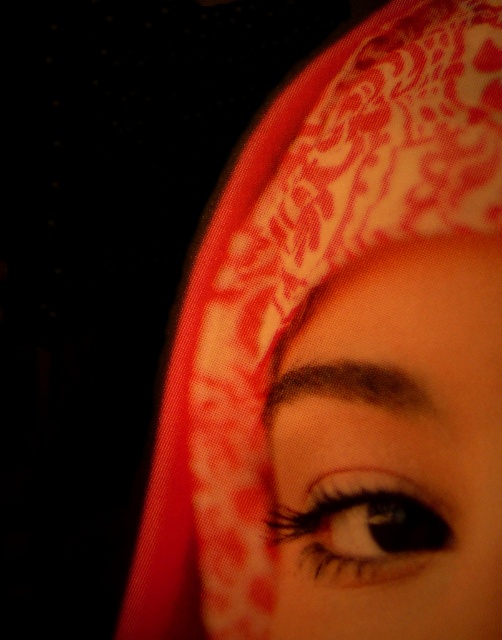
Question: Which point is farther to the camera?

Choices:
 (A) (499, 378)
 (B) (397, 518)

Answer: (B)

Question: Which of these objects is positioned farthest from the black glossy eye at center?

Choices:
 (A) dark brown eyebrow at upper center
 (B) matte red headscarf at upper center

Answer: (A)

Question: Which of the following is the farthest from the observer?

Choices:
 (A) dark brown eyebrow at upper center
 (B) black glossy eye at center

Answer: (A)

Question: Can you confirm if black glossy eye at center is bigger than dark brown eyebrow at upper center?

Choices:
 (A) no
 (B) yes

Answer: (B)

Question: Is matte red headscarf at upper center below dark brown eyebrow at upper center?

Choices:
 (A) yes
 (B) no

Answer: (A)

Question: Can you confirm if matte red headscarf at upper center is wider than dark brown eyebrow at upper center?

Choices:
 (A) no
 (B) yes

Answer: (B)